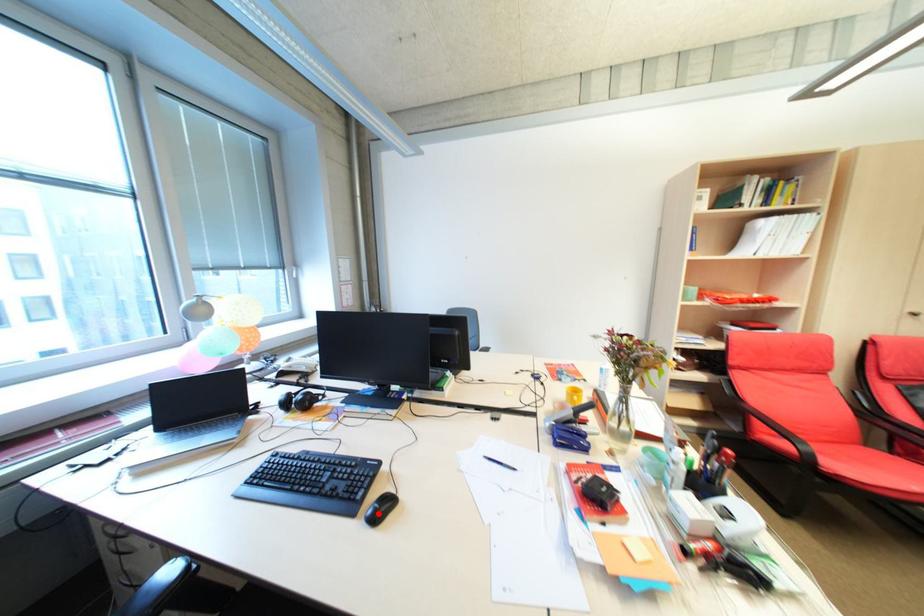
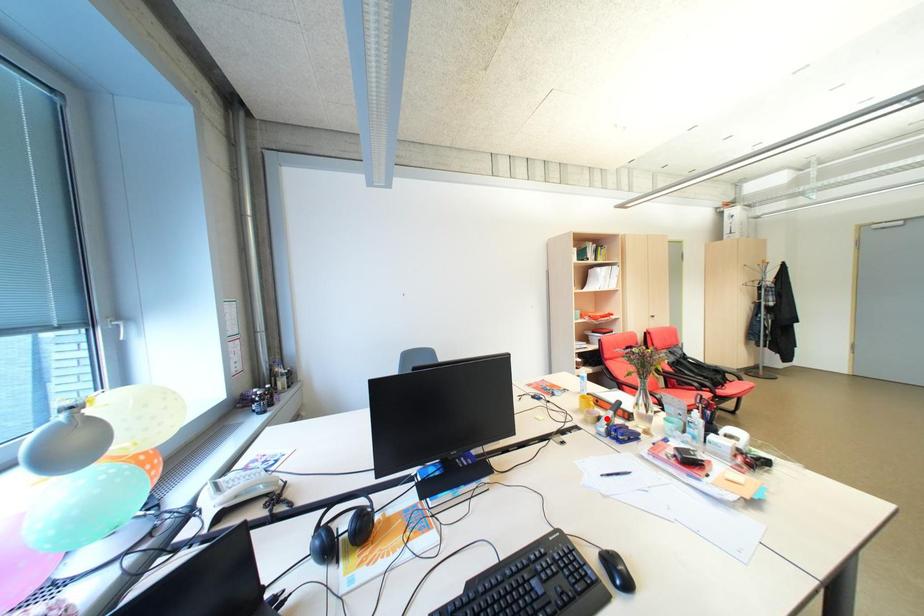
I am providing you with two images of the same scene from different viewpoints. A red point is marked on the first image and another point is marked on the second image. Is the red point in image1 aligned with the point shown in image2?

No